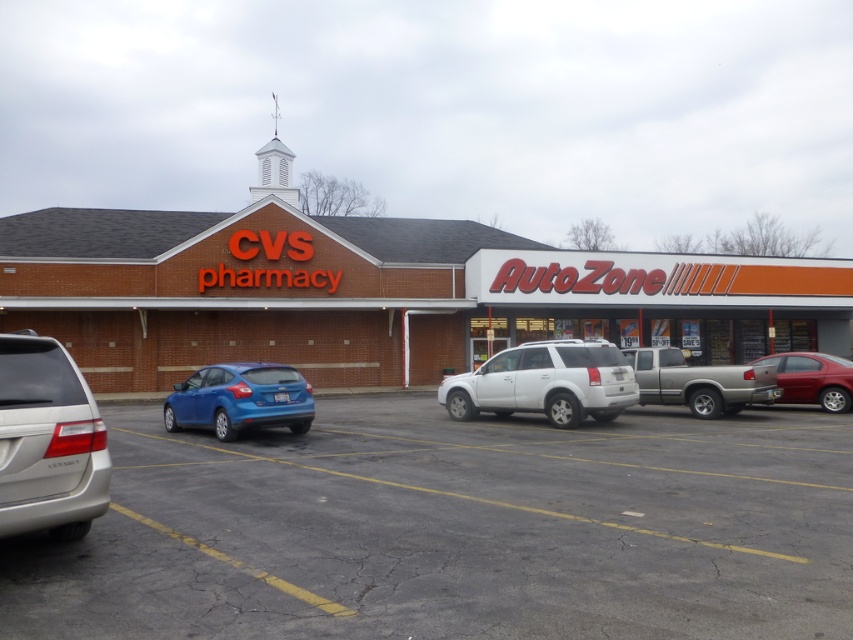
Is white matte suv at center below metallic red sedan at right?

Indeed, white matte suv at center is positioned under metallic red sedan at right.

Does white matte suv at center appear over metallic red sedan at right?

Incorrect, white matte suv at center is not positioned above metallic red sedan at right.

Describe the element at coordinates (544, 381) in the screenshot. I see `white matte suv at center` at that location.

Where is `white matte suv at center`? The height and width of the screenshot is (640, 853). white matte suv at center is located at coordinates pyautogui.click(x=544, y=381).

Which is more to the right, smooth asphalt parking lot at lower left or satin silver minivan at lower left?

From the viewer's perspective, smooth asphalt parking lot at lower left appears more on the right side.

Does smooth asphalt parking lot at lower left appear over satin silver minivan at lower left?

No.

Find the location of a particular element. smooth asphalt parking lot at lower left is located at coordinates (456, 529).

Which is more to the left, matte blue hatchback at lower left or silver metallic truck at center-right?

matte blue hatchback at lower left

Based on the photo, is matte blue hatchback at lower left below silver metallic truck at center-right?

Yes.

Does point (189, 387) come farther from viewer compared to point (699, 397)?

No.

Where is `matte blue hatchback at lower left`? matte blue hatchback at lower left is located at coordinates (241, 400).